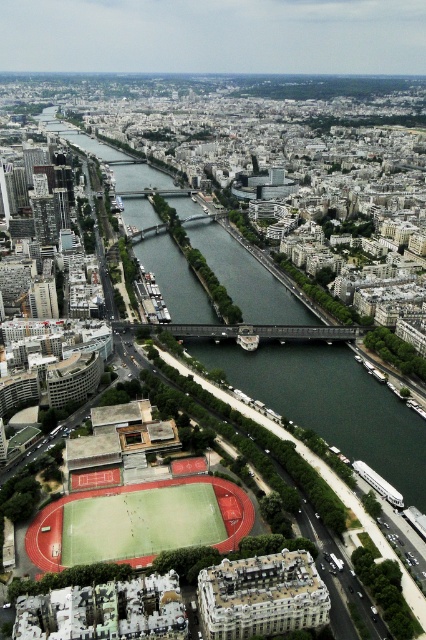
You are a drone operator trying to capture a photo of the green turf football field at lower center and the dark green water at center. From your current position, you can only see the objects that are wider than 50 meters. Can you see both objects?

The dark green water at center is wider than the green turf football field at lower center. Since the dark green water at center is wider than 50 meters, you can see it. However, the width of the green turf football field at lower center is unknown, so it might not be visible.